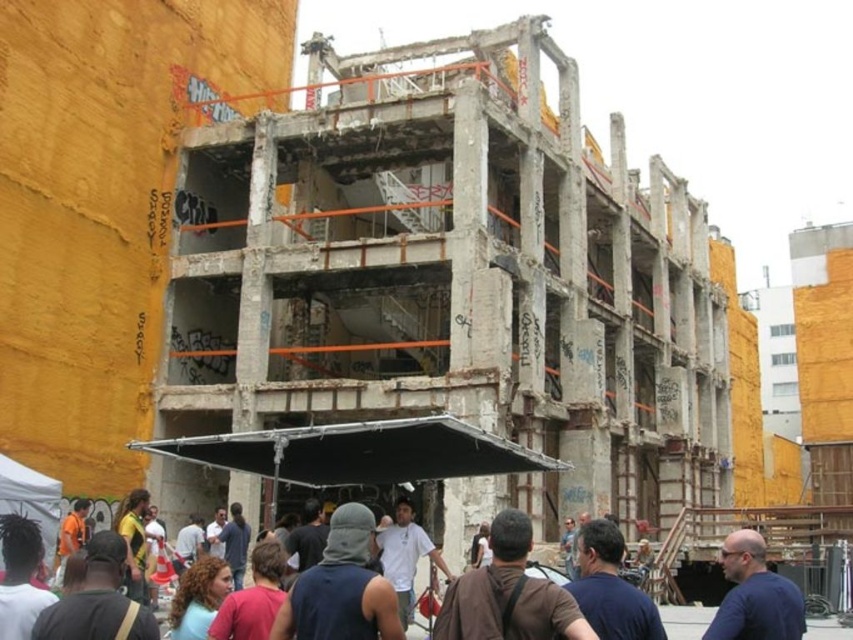
Question: Which point is closer to the camera taking this photo?

Choices:
 (A) (753, 602)
 (B) (775, 604)

Answer: (B)

Question: Can you confirm if dark brown leather jacket at lower center is positioned above blue shirt at center?

Choices:
 (A) no
 (B) yes

Answer: (B)

Question: Which point is farther from the camera taking this photo?

Choices:
 (A) 512,554
 (B) 787,634

Answer: (A)

Question: Does dark brown leather jacket at lower center have a smaller size compared to blue shirt at center?

Choices:
 (A) yes
 (B) no

Answer: (B)

Question: In this image, where is dark brown leather jacket at lower center located relative to blue shirt at center?

Choices:
 (A) left
 (B) right

Answer: (A)